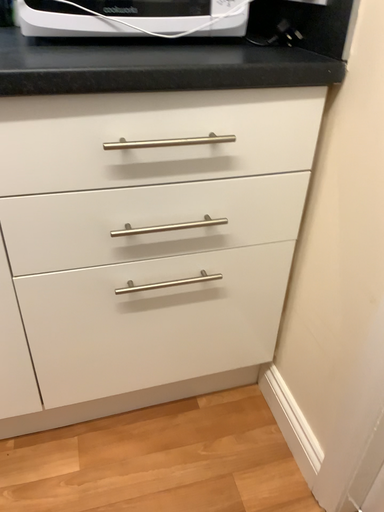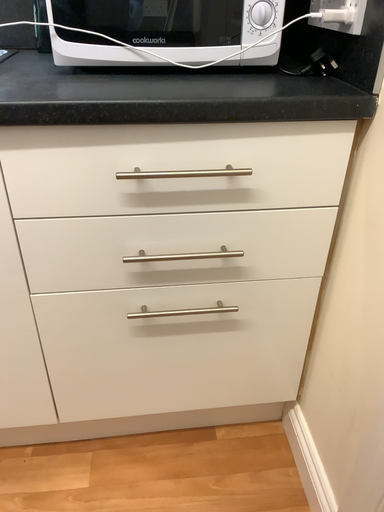
Question: How did the camera likely rotate when shooting the video?

Choices:
 (A) rotated right
 (B) rotated left

Answer: (B)